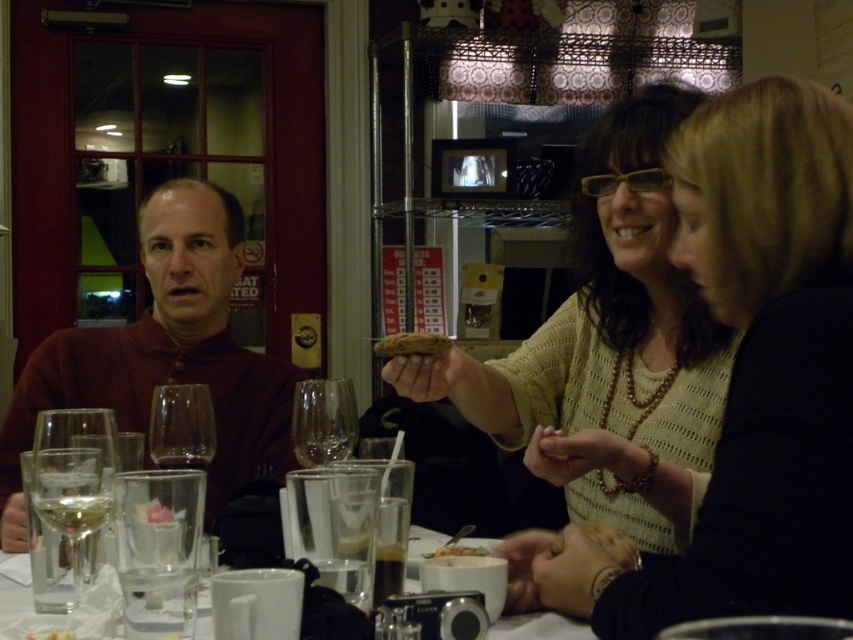
In the dining scene, there is a point marked at coordinates (164,355). What object or person does this point correspond to?

The point at coordinates (164,355) corresponds to the matte brown shirt at left.

You are setting up a small plate for the brown crumbly bread at center. The plate you have is exactly the same size as the white glossy mug at lower center. Will the bread fit on the plate?

The white glossy mug at lower center might be wider than brown crumbly bread at center, so the plate might be wide enough to fit the bread.

You are a waiter at the restaurant and need to serve a customer who ordered both wine and soup. The customer has a clear glass wine glass at center and a white creamy soup at center on their table. Which item should you refill first based on their sizes?

The clear glass wine glass at center is smaller than the white creamy soup at center, so you should refill the white creamy soup at center first to ensure it doesn not run out before the wine glass is empty.